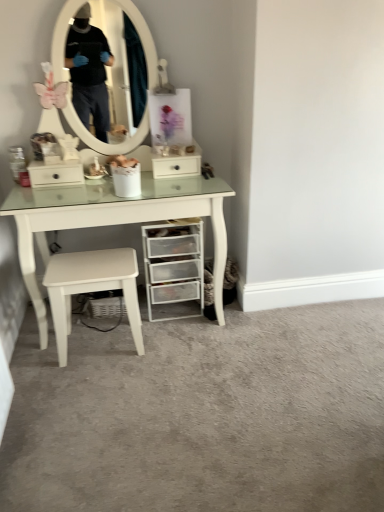
The width and height of the screenshot is (384, 512). I want to click on free space above white glossy drawer at center (from a real-world perspective), so click(x=172, y=154).